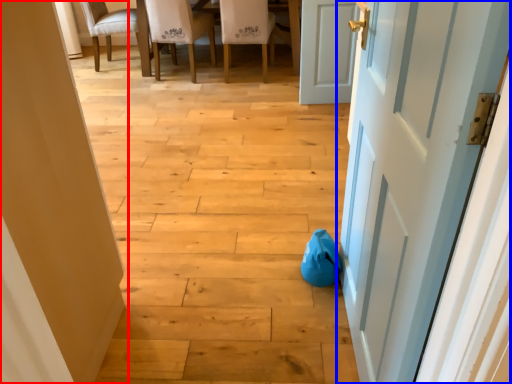
Question: Which object appears farthest to the camera in this image, door (highlighted by a red box) or door (highlighted by a blue box)?

Choices:
 (A) door
 (B) door

Answer: (A)